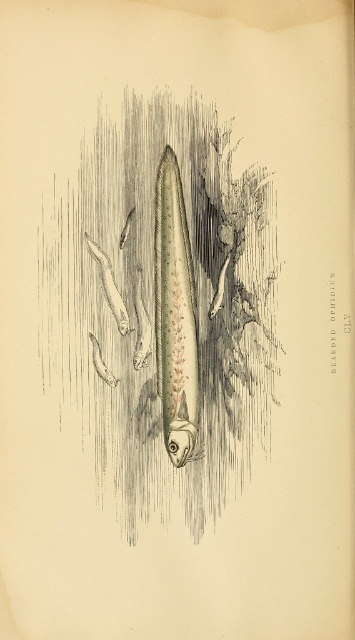
You are an underwater photographer trying to capture the Bearded Ophidium. You notice two points on the fish, one at coordinates point (129, 436) and another at point (155, 205). Which point should you focus on first to ensure the fish is in sharp focus?

You should focus on point (129, 436) first because it is closer to the camera than point (155, 205), ensuring the fish is in sharp focus.